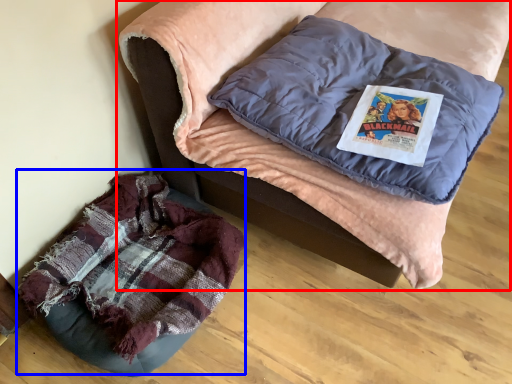
Question: Among these objects, which one is nearest to the camera, furniture (highlighted by a red box) or bean bag chair (highlighted by a blue box)?

Choices:
 (A) furniture
 (B) bean bag chair

Answer: (A)